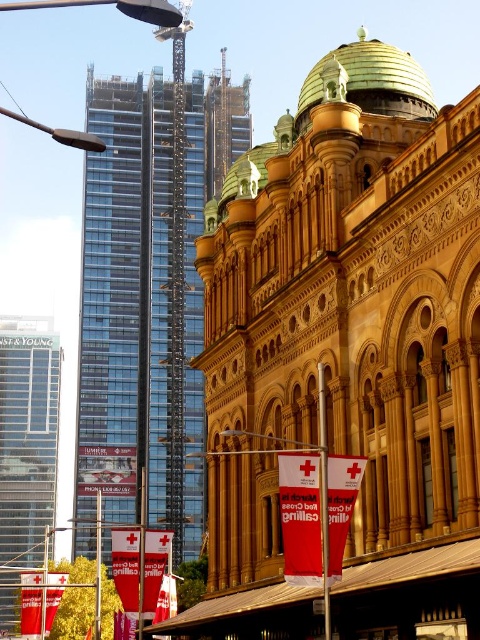
Is glassy steel tower at left below red plastic pole at center?

Correct, glassy steel tower at left is located below red plastic pole at center.

Which is behind, point (17, 442) or point (324, 464)?

Positioned behind is point (17, 442).

The width and height of the screenshot is (480, 640). Describe the element at coordinates (27, 435) in the screenshot. I see `glassy steel tower at left` at that location.

Locate an element on the screen. glassy steel tower at left is located at coordinates (27, 435).

Is glassy steel tower at upper left below metallic pole at center?

Actually, glassy steel tower at upper left is above metallic pole at center.

Locate an element on the screen. The width and height of the screenshot is (480, 640). glassy steel tower at upper left is located at coordinates (225, 125).

The width and height of the screenshot is (480, 640). What are the coordinates of `glassy steel tower at upper left` in the screenshot? It's located at (225, 125).

Between red plastic pole at center and metallic pole at center, which one has more height?

metallic pole at center

Is point (321, 387) positioned behind point (94, 636)?

No, (321, 387) is in front of (94, 636).

Does point (322, 492) come behind point (97, 608)?

No.

Locate an element on the screen. red plastic pole at center is located at coordinates (324, 497).